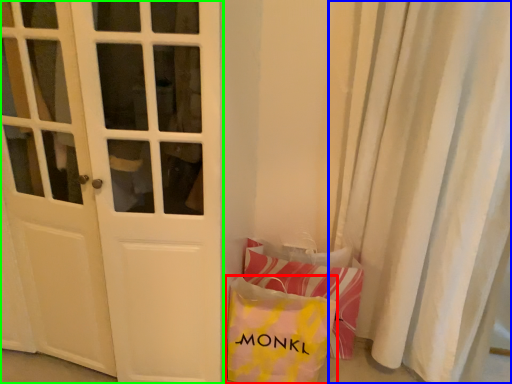
Question: Considering the real-world distances, which object is closest to pouch (highlighted by a red box)? curtain (highlighted by a blue box) or door (highlighted by a green box).

Choices:
 (A) curtain
 (B) door

Answer: (B)